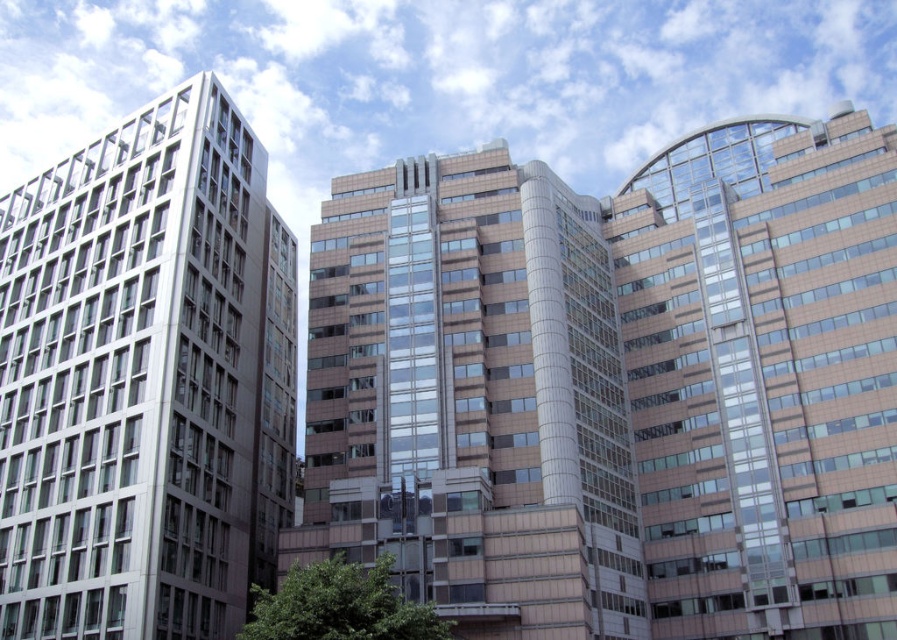
Which is more to the right, metallic glass building at left or beige glass building at center?

beige glass building at center

Is metallic glass building at left positioned in front of beige glass building at center?

Yes, metallic glass building at left is closer to the viewer.

Between point (214, 326) and point (312, 444), which one is positioned behind?

Point (312, 444)

Find the location of `metallic glass building at left`. metallic glass building at left is located at coordinates (145, 380).

Can you confirm if metallic glass building at left is positioned to the right of matte glass building at right?

In fact, metallic glass building at left is to the left of matte glass building at right.

Can you confirm if metallic glass building at left is positioned above matte glass building at right?

Incorrect, metallic glass building at left is not positioned above matte glass building at right.

Locate an element on the screen. This screenshot has width=897, height=640. metallic glass building at left is located at coordinates point(145,380).

Does beige glass building at center appear over matte glass building at right?

No.

Between point (573, 314) and point (884, 552), which one is positioned in front?

Point (884, 552) is more forward.

Looking at this image, measure the distance between point (534, 436) and camera.

Point (534, 436) and camera are 56.14 meters apart.

Identify the location of beige glass building at center. (472, 397).